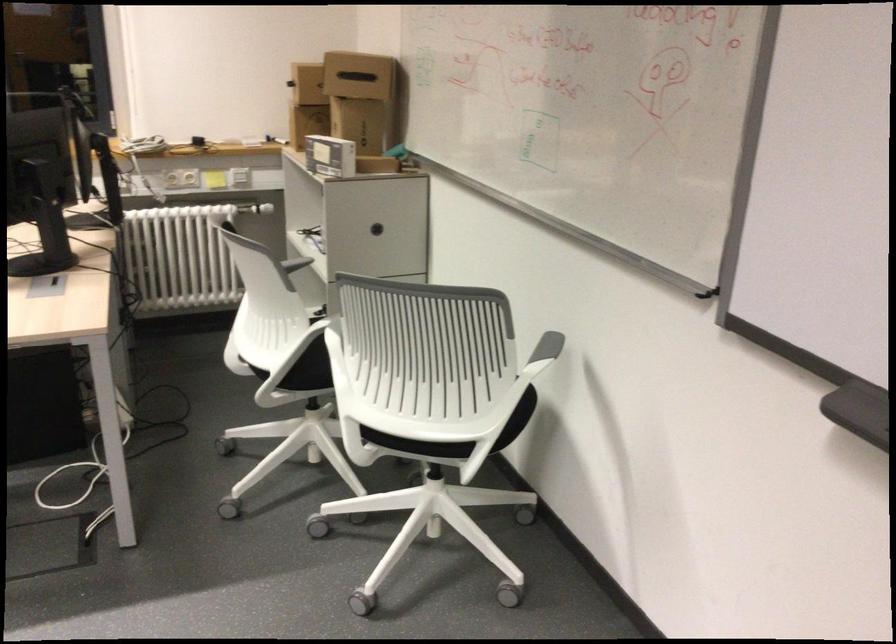
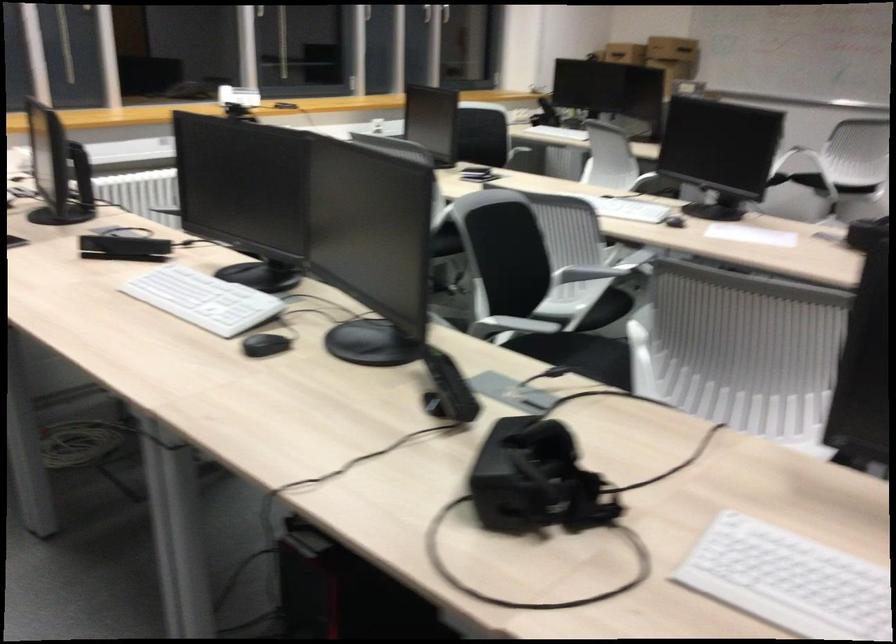
Question: I am providing you with two images of the same scene from different viewpoints. Please identify which objects are invisible in image2.

Choices:
 (A) spare toilet paper
 (B) chair armrest
 (C) black computer mouse
 (D) round cabinet handle

Answer: (D)